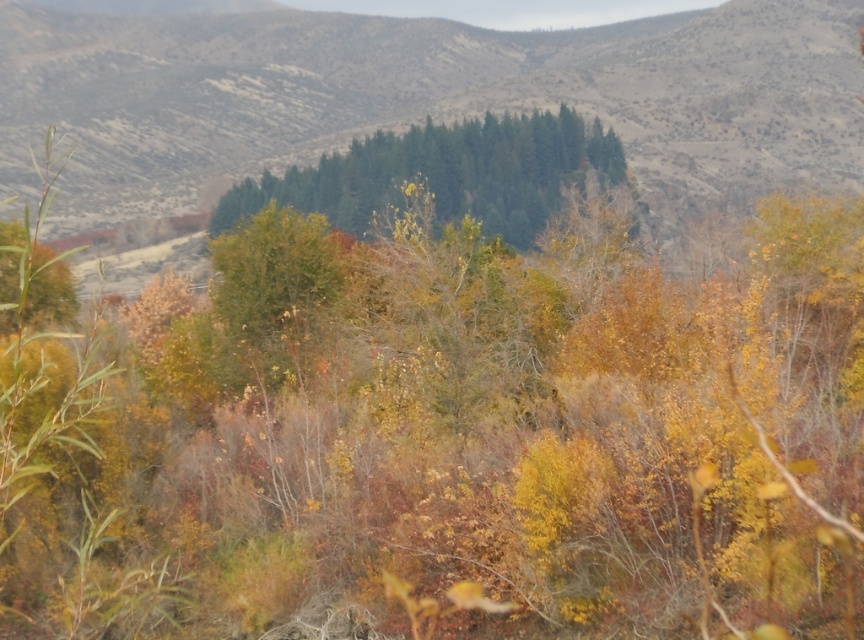
Which is behind, point (345, 19) or point (500, 161)?

The point (345, 19) is more distant.

Does point (747, 72) come behind point (513, 230)?

Yes.

Between point (721, 168) and point (461, 145), which one is positioned in front?

Positioned in front is point (461, 145).

Find the location of a particular element. The image size is (864, 640). green textured trees at center is located at coordinates (418, 96).